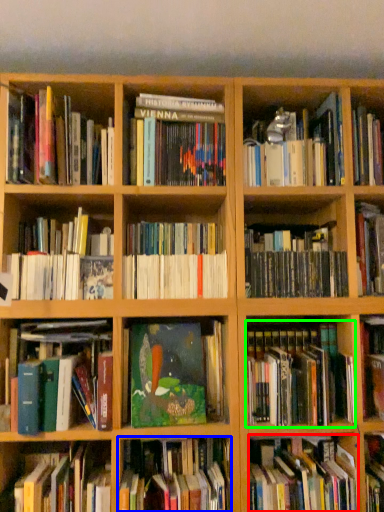
Question: Which object is positioned closest to book (highlighted by a red box)? Select from book (highlighted by a blue box) and book (highlighted by a green box).

Choices:
 (A) book
 (B) book

Answer: (B)